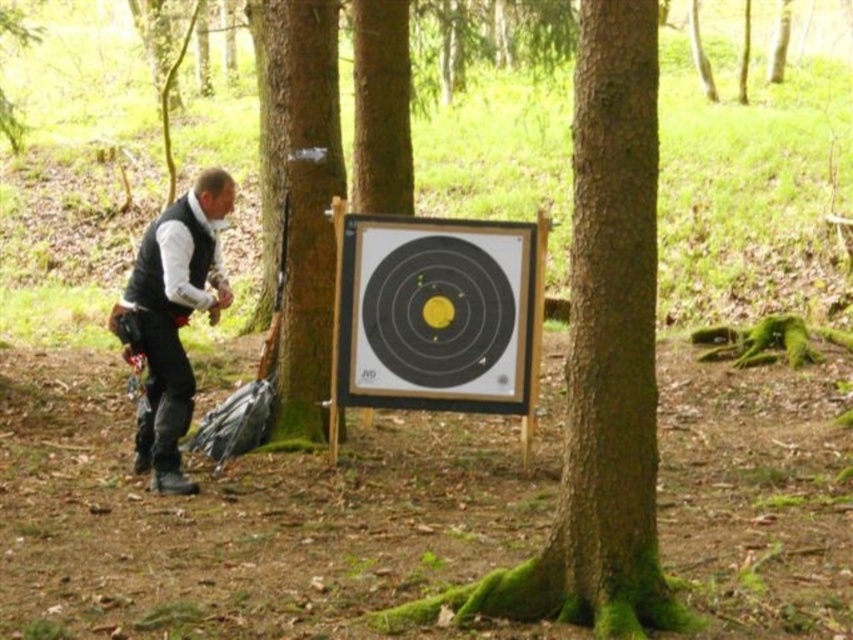
You are an archer preparing to shoot an arrow at the target board between the two trees. You notice the green mossy tree at center and the black matte vest at left. Which object is taller?

The green mossy tree at center is taller than the black matte vest at left according to the description.

You are an archer aiming to hit the target board between the green mossy tree at center and the black matte vest at left. Which object is wider so you can estimate your arrow trajectory better?

The green mossy tree at center is wider than the black matte vest at left, so you should aim considering the wider width of the green mossy tree at center to adjust your arrow trajectory accordingly.

You are an archer preparing to shoot an arrow at the target board between the green mossy tree at center and the black matte vest at left. Which object is closer to the target board?

The green mossy tree at center is closer to the target board because it is positioned over the black matte vest at left, indicating it is in front of the vest and thus nearer to the target.